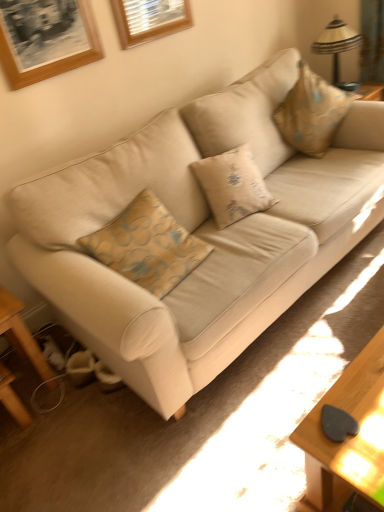
Question: Is beige fabric couch at center oriented away from wooden picture frame at upper left, which is the 1th picture frame in left-to-right order?

Choices:
 (A) no
 (B) yes

Answer: (A)

Question: Is the surface of beige fabric couch at center in direct contact with wooden picture frame at upper left, which is the 1th picture frame in left-to-right order?

Choices:
 (A) yes
 (B) no

Answer: (B)

Question: From the image's perspective, would you say beige fabric couch at center is positioned over wooden picture frame at upper left, which ranks as the second picture frame in back-to-front order?

Choices:
 (A) no
 (B) yes

Answer: (A)

Question: Does beige fabric couch at center have a greater height compared to wooden picture frame at upper left, which ranks as the first picture frame in front-to-back order?

Choices:
 (A) no
 (B) yes

Answer: (B)

Question: Does beige fabric couch at center have a lesser height compared to wooden picture frame at upper left, the second picture frame from the right?

Choices:
 (A) no
 (B) yes

Answer: (A)

Question: Considering their positions, is wooden picture frame at upper left, which ranks as the second picture frame in back-to-front order, located in front of or behind beige fabric couch at center?

Choices:
 (A) front
 (B) behind

Answer: (B)

Question: Is wooden picture frame at upper left, which ranks as the second picture frame in back-to-front order, inside or outside of beige fabric couch at center?

Choices:
 (A) outside
 (B) inside

Answer: (A)

Question: From the image's perspective, relative to beige fabric couch at center, is wooden picture frame at upper left, which ranks as the first picture frame in front-to-back order, above or below?

Choices:
 (A) below
 (B) above

Answer: (B)

Question: Looking at their shapes, would you say wooden picture frame at upper left, which is the 1th picture frame in left-to-right order, is wider or thinner than beige fabric couch at center?

Choices:
 (A) thin
 (B) wide

Answer: (A)

Question: Choose the correct answer: Is wooden picture frame at upper left, the second picture frame from the right, inside beige fabric pillow at upper right or outside it?

Choices:
 (A) outside
 (B) inside

Answer: (A)

Question: Considering the positions of wooden picture frame at upper left, which is the 1th picture frame in left-to-right order, and beige fabric pillow at upper right in the image, is wooden picture frame at upper left, which is the 1th picture frame in left-to-right order, taller or shorter than beige fabric pillow at upper right?

Choices:
 (A) short
 (B) tall

Answer: (A)

Question: From a real-world perspective, relative to beige fabric pillow at upper right, is wooden picture frame at upper left, which is the 1th picture frame in left-to-right order, vertically above or below?

Choices:
 (A) below
 (B) above

Answer: (B)

Question: Looking at the image, does wooden picture frame at upper left, the second picture frame from the right, seem bigger or smaller compared to beige fabric pillow at upper right?

Choices:
 (A) big
 (B) small

Answer: (B)

Question: From the image's perspective, relative to beige fabric couch at center, is wooden table at lower left above or below?

Choices:
 (A) above
 (B) below

Answer: (B)

Question: Relative to beige fabric couch at center, is wooden table at lower left in front or behind?

Choices:
 (A) behind
 (B) front

Answer: (A)